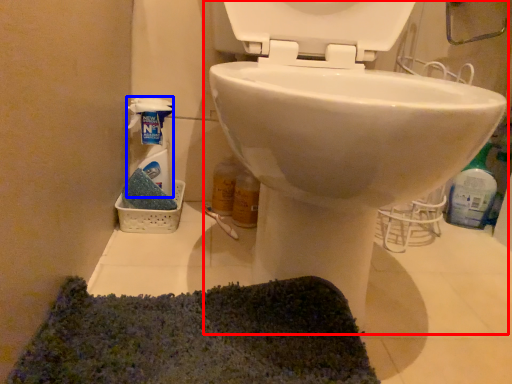
Question: Which of the following is the closest to the observer, toilet (highlighted by a red box) or cleaning product (highlighted by a blue box)?

Choices:
 (A) toilet
 (B) cleaning product

Answer: (A)